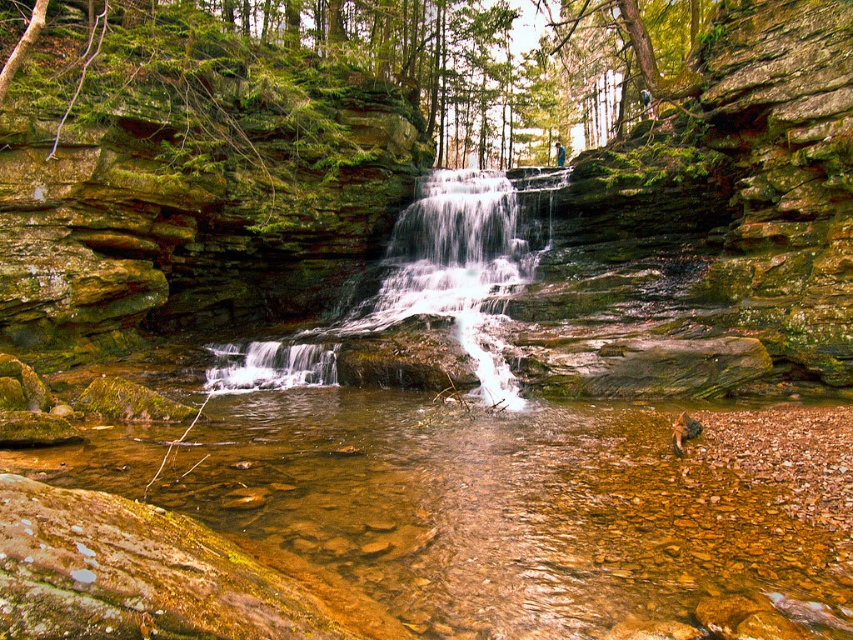
Looking at this image, you are a hiker who wants to cross the stream to reach the other side. The clear water at center is where the stream is calmest. The translucent glass waterfall at center is where the water is flowing the fastest. Given that your backpack weighs 15 kg, which location would be safest to cross?

The clear water at center is the safest location to cross because it is calmer and has a distance of 7.59 meters from the faster flowing translucent glass waterfall at center, making it a more stable crossing point.

You are a hiker who wants to cross the stream at the center of the scene. The clear water at center and the translucent glass waterfall at center are in your path. Which one is smaller and can you safely step over it?

The clear water at center has a smaller size compared to the translucent glass waterfall at center. Since it is smaller, you can safely step over the clear water at center.

Based on the photo, you are an explorer trying to cross the stream. You see the clear water at center and the translucent glass waterfall at center. Which one is deeper?

The clear water at center is not as tall as the translucent glass waterfall at center, so the translucent glass waterfall at center is deeper.